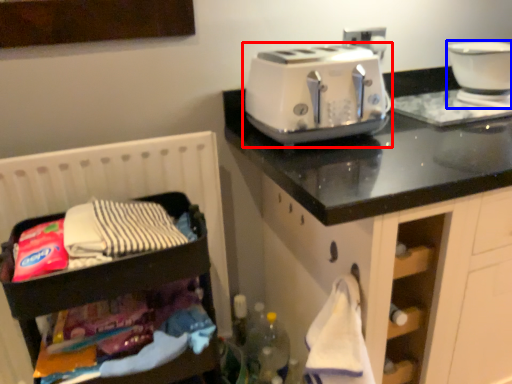
Question: Which of the following is the closest to the observer, toaster (highlighted by a red box) or home appliance (highlighted by a blue box)?

Choices:
 (A) toaster
 (B) home appliance

Answer: (A)